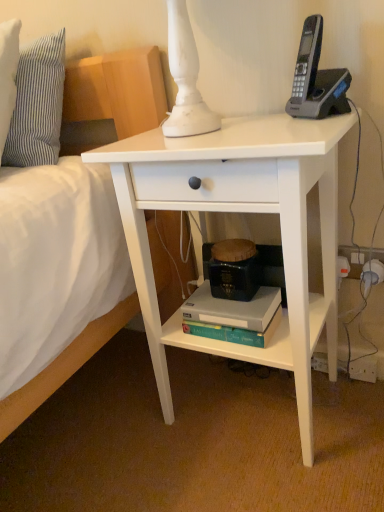
Image resolution: width=384 pixels, height=512 pixels. Describe the element at coordinates (245, 212) in the screenshot. I see `white matte desk at center` at that location.

Find the location of a particular element. The width and height of the screenshot is (384, 512). black plastic phone at upper right is located at coordinates (316, 79).

Is black plastic phone at upper right far from teal matte paperback book at lower center?

No, black plastic phone at upper right is in close proximity to teal matte paperback book at lower center.

In the image, is black plastic phone at upper right positioned in front of or behind teal matte paperback book at lower center?

black plastic phone at upper right is positioned closer to the viewer than teal matte paperback book at lower center.

Is point (304, 42) closer or farther from the camera than point (247, 326)?

Point (304, 42).

Is striped fabric pillow at upper left at the right side of white matte desk at center?

In fact, striped fabric pillow at upper left is to the left of white matte desk at center.

Is striped fabric pillow at upper left smaller than white matte desk at center?

Yes, striped fabric pillow at upper left is smaller than white matte desk at center.

Which object is closer to the camera taking this photo, striped fabric pillow at upper left or white matte desk at center?

white matte desk at center is more forward.

From a real-world perspective, which is physically below, striped fabric pillow at upper left or white matte desk at center?

From a 3D spatial view, white matte desk at center is below.

Between teal matte paperback book at lower center and white matte desk at center, which one is positioned in front?

white matte desk at center is more forward.

Can you confirm if teal matte paperback book at lower center is positioned to the right of white matte desk at center?

In fact, teal matte paperback book at lower center is to the left of white matte desk at center.

From the image's perspective, between teal matte paperback book at lower center and white matte desk at center, who is located below?

teal matte paperback book at lower center appears lower in the image.

Locate an element on the screen. desk that appears above the teal matte paperback book at lower center (from a real-world perspective) is located at coordinates (245, 212).

The width and height of the screenshot is (384, 512). What are the coordinates of `desk that is in front of the black plastic phone at upper right` in the screenshot? It's located at (245, 212).

Based on the photo, which point is more distant from viewer, [305,84] or [274,133]?

Positioned behind is point [305,84].

Would you say black plastic phone at upper right is a long distance from white matte desk at center?

No, black plastic phone at upper right is not far away from white matte desk at center.

From the image's perspective, is black plastic phone at upper right below white matte desk at center?

Actually, black plastic phone at upper right appears above white matte desk at center in the image.

Which object is more forward, white matte desk at center or teal matte paperback book at lower center?

Positioned in front is white matte desk at center.

Is white matte desk at center oriented away from teal matte paperback book at lower center?

Yes, teal matte paperback book at lower center is at the back of white matte desk at center.

How far apart are white matte desk at center and teal matte paperback book at lower center?

They are 21.45 centimeters apart.

Based on the photo, can you confirm if white matte desk at center is thinner than teal matte paperback book at lower center?

Incorrect, the width of white matte desk at center is not less than that of teal matte paperback book at lower center.

What's the angular difference between teal matte paperback book at lower center and black plastic phone at upper right's facing directions?

The angle between the facing direction of teal matte paperback book at lower center and the facing direction of black plastic phone at upper right is 39.2 degrees.

Which object is closer to the camera, teal matte paperback book at lower center or black plastic phone at upper right?

black plastic phone at upper right is in front.

From a real-world perspective, is teal matte paperback book at lower center beneath black plastic phone at upper right?

Yes, from a real-world perspective, teal matte paperback book at lower center is below black plastic phone at upper right.

You are a GUI agent. You are given a task and a screenshot of the screen. Output one action in this format:
    pyautogui.click(x=<x>, y=<y>)
    Task: Click on the paperback book located behind the black plastic phone at upper right
    
    Given the screenshot: What is the action you would take?
    pyautogui.click(x=233, y=309)

Is striped fabric pillow at upper left in front of teal matte paperback book at lower center?

That is False.

Which object is positioned more to the left, striped fabric pillow at upper left or teal matte paperback book at lower center?

striped fabric pillow at upper left.

Does striped fabric pillow at upper left have a lesser height compared to teal matte paperback book at lower center?

No, striped fabric pillow at upper left is not shorter than teal matte paperback book at lower center.

Find the location of a particular element. The image size is (384, 512). paperback book on the left of black plastic phone at upper right is located at coordinates (233, 309).

You are a GUI agent. You are given a task and a screenshot of the screen. Output one action in this format:
    pyautogui.click(x=<x>, y=<y>)
    Task: Click on the pillow behind the white matte desk at center
    The height and width of the screenshot is (512, 384).
    Given the screenshot: What is the action you would take?
    pyautogui.click(x=37, y=104)

Considering their positions, is striped fabric pillow at upper left positioned further to teal matte paperback book at lower center than white matte desk at center?

striped fabric pillow at upper left is further to teal matte paperback book at lower center.

Which object lies nearer to the anchor point black plastic phone at upper right, striped fabric pillow at upper left or white matte desk at center?

Among the two, white matte desk at center is located nearer to black plastic phone at upper right.

Which object lies further to the anchor point black plastic phone at upper right, white matte desk at center or striped fabric pillow at upper left?

striped fabric pillow at upper left.

Based on their spatial positions, is white matte desk at center or teal matte paperback book at lower center further from striped fabric pillow at upper left?

The object further to striped fabric pillow at upper left is teal matte paperback book at lower center.

When comparing their distances from black plastic phone at upper right, does teal matte paperback book at lower center or white matte desk at center seem closer?

Based on the image, white matte desk at center appears to be nearer to black plastic phone at upper right.

Based on their spatial positions, is teal matte paperback book at lower center or striped fabric pillow at upper left further from black plastic phone at upper right?

Based on the image, striped fabric pillow at upper left appears to be further to black plastic phone at upper right.

Considering their positions, is striped fabric pillow at upper left positioned closer to teal matte paperback book at lower center than black plastic phone at upper right?

The object closer to teal matte paperback book at lower center is black plastic phone at upper right.

When comparing their distances from striped fabric pillow at upper left, does black plastic phone at upper right or white matte desk at center seem further?

Based on the image, black plastic phone at upper right appears to be further to striped fabric pillow at upper left.

Identify the location of desk between striped fabric pillow at upper left and black plastic phone at upper right. This screenshot has width=384, height=512. (245, 212).

Where is `desk that lies between black plastic phone at upper right and teal matte paperback book at lower center from top to bottom`? The image size is (384, 512). desk that lies between black plastic phone at upper right and teal matte paperback book at lower center from top to bottom is located at coordinates (245, 212).

Where is `paperback book located between striped fabric pillow at upper left and black plastic phone at upper right in the left-right direction`? paperback book located between striped fabric pillow at upper left and black plastic phone at upper right in the left-right direction is located at coordinates point(233,309).

This screenshot has height=512, width=384. Identify the location of paperback book situated between striped fabric pillow at upper left and white matte desk at center from left to right. (233, 309).